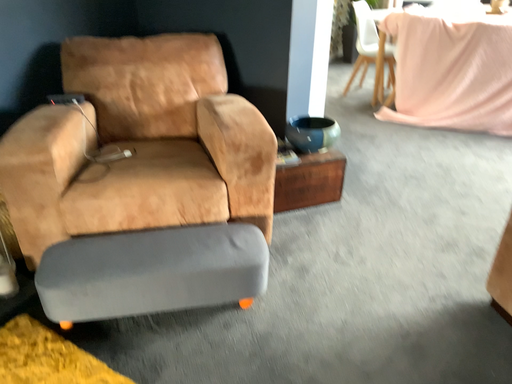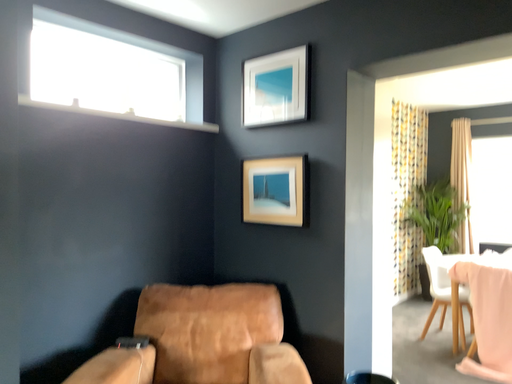
Question: Which way did the camera rotate in the video?

Choices:
 (A) rotated right
 (B) rotated left

Answer: (B)